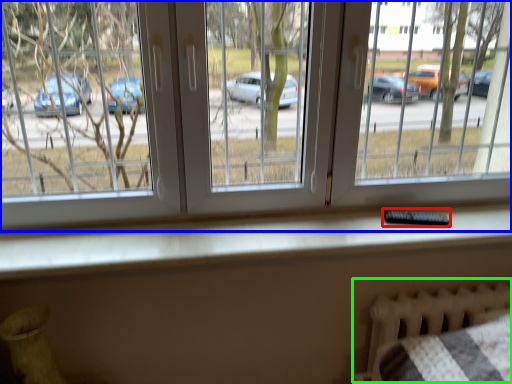
Question: Considering the real-world distances, which object is farthest from remote (highlighted by a red box)? window (highlighted by a blue box) or bed frame (highlighted by a green box)?

Choices:
 (A) window
 (B) bed frame

Answer: (A)